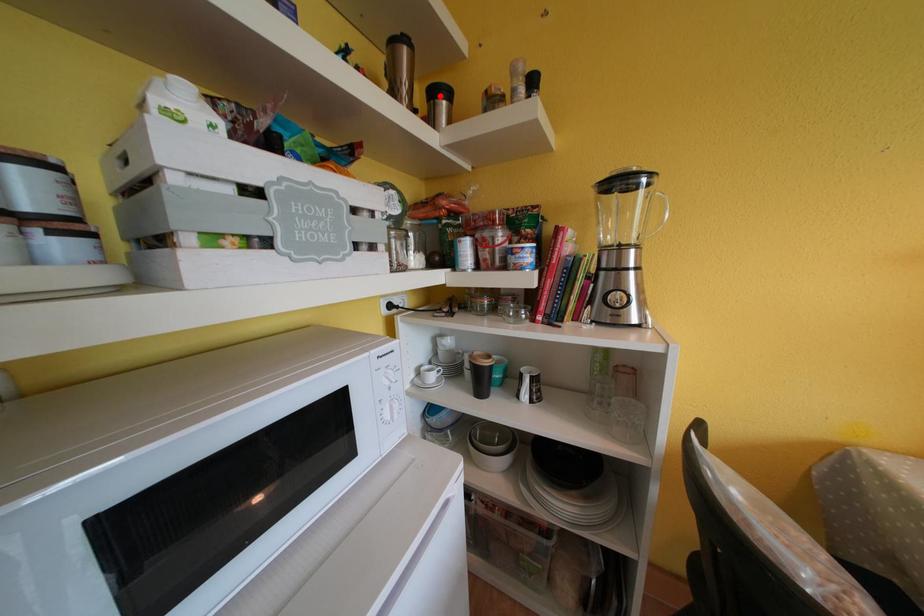
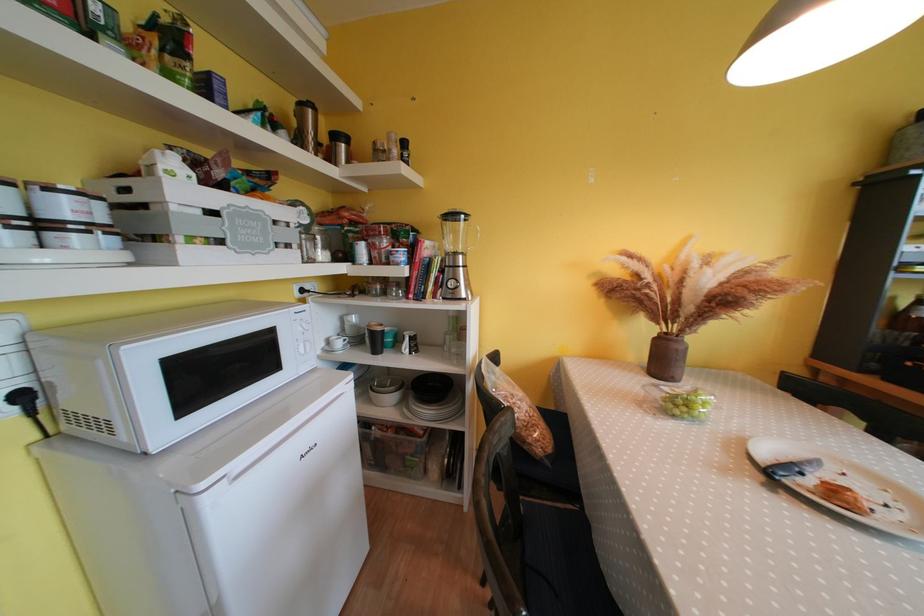
In the second image, find the point that corresponds to the highlighted location in the first image.

(342, 140)